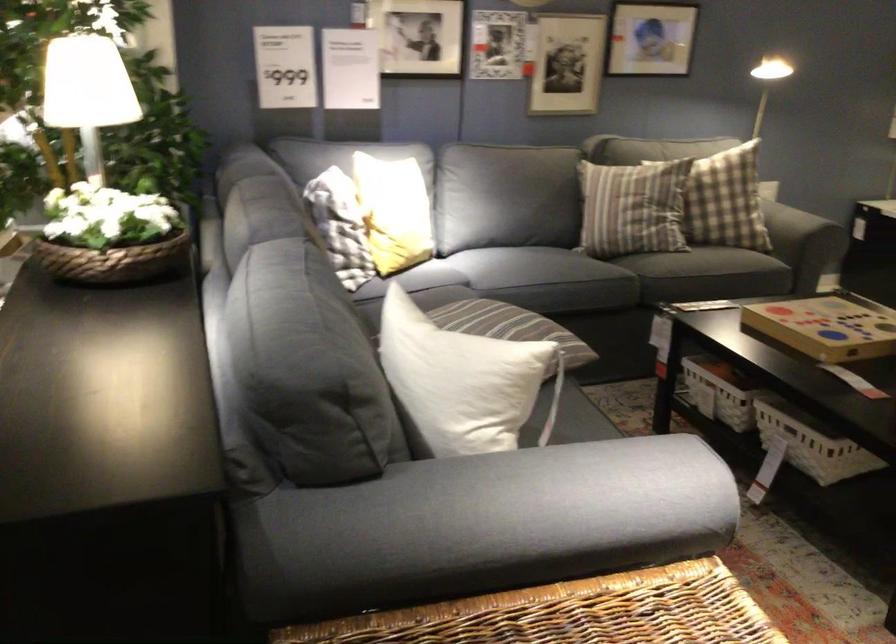
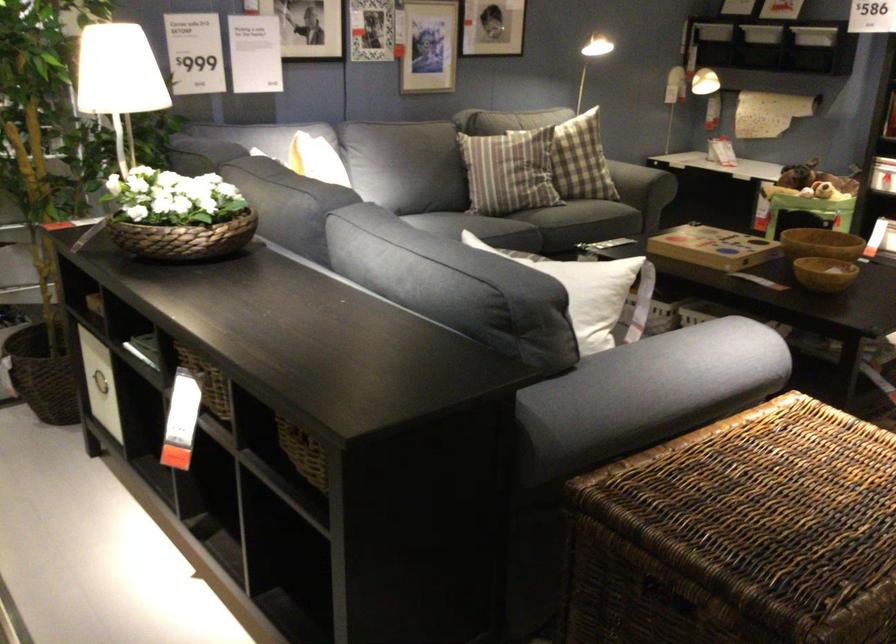
In the second image, find the point that corresponds to [464,529] in the first image.

(647, 393)